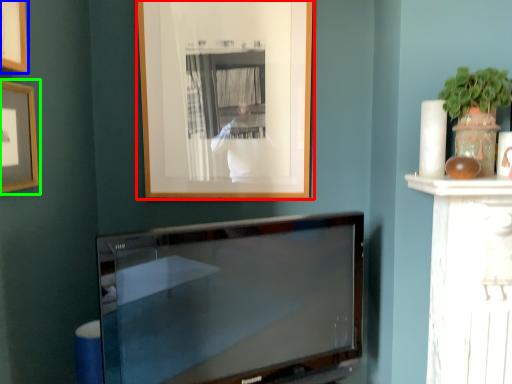
Question: Which object is the closest to the picture frame (highlighted by a red box)? Choose among these: picture frame (highlighted by a blue box) or picture frame (highlighted by a green box).

Choices:
 (A) picture frame
 (B) picture frame

Answer: (B)